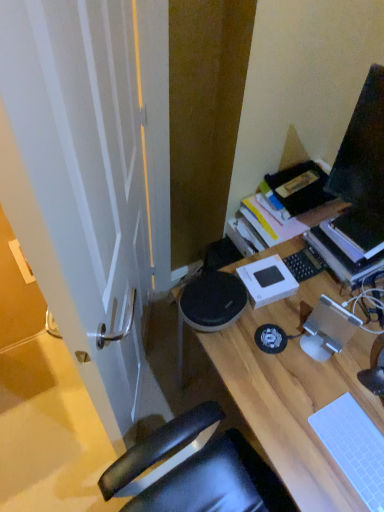
Question: Can you confirm if white matte laptop keyboard at lower right, the first laptop keyboard ordered from the bottom, is thinner than wooden desk at center?

Choices:
 (A) yes
 (B) no

Answer: (A)

Question: Considering the relative sizes of white matte laptop keyboard at lower right, the second laptop keyboard when ordered from back to front, and wooden desk at center in the image provided, is white matte laptop keyboard at lower right, the second laptop keyboard when ordered from back to front, taller than wooden desk at center?

Choices:
 (A) no
 (B) yes

Answer: (A)

Question: From a real-world perspective, is white matte laptop keyboard at lower right, placed as the second laptop keyboard when sorted from top to bottom, under wooden desk at center?

Choices:
 (A) no
 (B) yes

Answer: (A)

Question: Is white matte laptop keyboard at lower right, which is the first laptop keyboard in front-to-back order, far away from wooden desk at center?

Choices:
 (A) no
 (B) yes

Answer: (A)

Question: Can you confirm if white matte laptop keyboard at lower right, the first laptop keyboard ordered from the bottom, is shorter than wooden desk at center?

Choices:
 (A) no
 (B) yes

Answer: (B)

Question: Does white matte laptop keyboard at lower right, placed as the second laptop keyboard when sorted from top to bottom, appear on the right side of wooden desk at center?

Choices:
 (A) yes
 (B) no

Answer: (B)

Question: Is hardcover book at upper right wider than black matte laptop keyboard at center-right, placed as the 1th laptop keyboard when sorted from top to bottom?

Choices:
 (A) yes
 (B) no

Answer: (A)

Question: Is hardcover book at upper right thinner than black matte laptop keyboard at center-right, placed as the 1th laptop keyboard when sorted from back to front?

Choices:
 (A) yes
 (B) no

Answer: (B)

Question: Is hardcover book at upper right taller than black matte laptop keyboard at center-right, placed as the 1th laptop keyboard when sorted from top to bottom?

Choices:
 (A) yes
 (B) no

Answer: (A)

Question: From a real-world perspective, is hardcover book at upper right physically below black matte laptop keyboard at center-right, the 2th laptop keyboard when ordered from front to back?

Choices:
 (A) yes
 (B) no

Answer: (B)

Question: Does hardcover book at upper right lie in front of black matte laptop keyboard at center-right, placed as the 1th laptop keyboard when sorted from top to bottom?

Choices:
 (A) yes
 (B) no

Answer: (A)

Question: Is hardcover book at upper right located outside black matte laptop keyboard at center-right, placed as the 1th laptop keyboard when sorted from back to front?

Choices:
 (A) no
 (B) yes

Answer: (B)

Question: Is white matte laptop keyboard at lower right, the first laptop keyboard ordered from the bottom, at the right side of hardcover book at upper right?

Choices:
 (A) yes
 (B) no

Answer: (B)